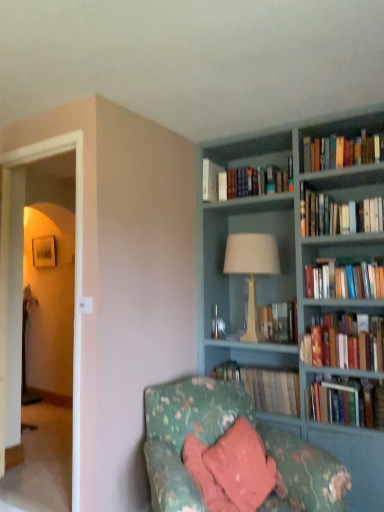
Locate an element on the screen. hardcover books at upper right, acting as the fifth book starting from the top is located at coordinates (344, 281).

I want to click on hardcover books at center, the fourth book in the bottom-to-top sequence, so click(279, 322).

The image size is (384, 512). Describe the element at coordinates (290, 281) in the screenshot. I see `teal painted wood bookcase at upper right` at that location.

Locate an element on the screen. The width and height of the screenshot is (384, 512). white fabric lampshade at center is located at coordinates (252, 269).

What is the approximate height of hardcover book at right, acting as the 3th book starting from the bottom?

It is 33.85 centimeters.

What do you see at coordinates (344, 342) in the screenshot? I see `hardcover book at right, acting as the 3th book starting from the bottom` at bounding box center [344, 342].

This screenshot has height=512, width=384. I want to click on hardcover books at upper right, acting as the fifth book starting from the top, so click(x=344, y=281).

In the scene shown: Is hardcover book at center, which ranks as the 2th book in bottom-to-top order, placed right next to hardcover book at right, acting as the 3th book starting from the bottom?

No, hardcover book at center, which ranks as the 2th book in bottom-to-top order, is not making contact with hardcover book at right, acting as the 3th book starting from the bottom.

Considering the positions of objects hardcover book at center, which ranks as the 2th book in bottom-to-top order, and hardcover book at right, acting as the 3th book starting from the bottom, in the image provided, who is behind, hardcover book at center, which ranks as the 2th book in bottom-to-top order, or hardcover book at right, acting as the 3th book starting from the bottom,?

hardcover book at center, which ranks as the 2th book in bottom-to-top order, is behind.

From the image's perspective, is hardcover book at center, which ranks as the 2th book in bottom-to-top order, above hardcover book at right, the 7th book from the top?

No.

At what (x,y) coordinates should I click in order to perform the action: click on the 1st book behind the hardcover book at right, the 7th book from the top. Please return your answer as a coordinate pair (x, y). Looking at the image, I should click on (347, 402).

Is hardcover books at upper center, the 7th book from the bottom, aimed at white fabric lampshade at center?

No, hardcover books at upper center, the 7th book from the bottom, is not oriented towards white fabric lampshade at center.

Based on the photo, is hardcover books at upper center, the 7th book from the bottom, beside white fabric lampshade at center?

hardcover books at upper center, the 7th book from the bottom, and white fabric lampshade at center are clearly separated.

Which object is wider, hardcover books at upper center, the 7th book from the bottom, or white fabric lampshade at center?

With larger width is white fabric lampshade at center.

Between hardcover books at upper center, positioned as the third book in top-to-bottom order, and white fabric lampshade at center, which one has more height?

white fabric lampshade at center.

Is teal painted wood bookcase at upper right not close to floral fabric couch at lower right?

teal painted wood bookcase at upper right is near floral fabric couch at lower right, not far away.

From the picture: From a real-world perspective, is teal painted wood bookcase at upper right above or below floral fabric couch at lower right?

In terms of real-world spatial position, teal painted wood bookcase at upper right is above floral fabric couch at lower right.

Visually, is teal painted wood bookcase at upper right positioned to the left or to the right of floral fabric couch at lower right?

From the image, it's evident that teal painted wood bookcase at upper right is to the right of floral fabric couch at lower right.

Does point (231, 244) appear closer or farther from the camera than point (264, 362)?

Point (231, 244) is closer to the camera than point (264, 362).

Between white fabric lampshade at center and teal painted wood bookcase at upper right, which one has larger size?

teal painted wood bookcase at upper right is bigger.

Is white fabric lampshade at center positioned in front of teal painted wood bookcase at upper right?

No, white fabric lampshade at center is further to the viewer.

Is white fabric lampshade at center not inside teal painted wood bookcase at upper right?

Actually, white fabric lampshade at center is within teal painted wood bookcase at upper right.

From the image's perspective, which book is the 3rd one above the hardcover book at right, acting as the 3th book starting from the bottom? Please provide its 2D coordinates.

[(338, 214)]

From a real-world perspective, between hardcover book at right, acting as the 3th book starting from the bottom, and hardcover books at upper right, arranged as the 4th book when viewed from the top, who is vertically higher?

hardcover books at upper right, arranged as the 4th book when viewed from the top, is physically above.

Could you measure the distance between hardcover book at right, the 7th book from the top, and hardcover books at upper right, the 6th book when ordered from bottom to top?

A distance of 62.58 centimeters exists between hardcover book at right, the 7th book from the top, and hardcover books at upper right, the 6th book when ordered from bottom to top.

Which of these two, hardcover book at right, the 7th book from the top, or hardcover books at upper right, arranged as the 4th book when viewed from the top, is thinner?

hardcover book at right, the 7th book from the top.

Is hardcover books at upper right, arranged as the 4th book when viewed from the top, in front of white matte book at upper center, acting as the 8th book starting from the bottom?

Yes, hardcover books at upper right, arranged as the 4th book when viewed from the top, is in front of white matte book at upper center, acting as the 8th book starting from the bottom.

Is white matte book at upper center, acting as the 8th book starting from the bottom, surrounded by hardcover books at upper right, the 6th book when ordered from bottom to top?

No, white matte book at upper center, acting as the 8th book starting from the bottom, is not surrounded by hardcover books at upper right, the 6th book when ordered from bottom to top.

Can you tell me how much hardcover books at upper right, arranged as the 4th book when viewed from the top, and white matte book at upper center, acting as the 8th book starting from the bottom, differ in facing direction?

They differ by 0.68 degrees in their facing directions.

Based on the photo, how far apart are hardcover books at upper right, the 6th book when ordered from bottom to top, and white matte book at upper center, arranged as the second book when viewed from the top?

hardcover books at upper right, the 6th book when ordered from bottom to top, and white matte book at upper center, arranged as the second book when viewed from the top, are 32.12 inches apart from each other.

Is transparent glass door at left with wooden book at center, the 1th book in the bottom-to-top sequence?

No, transparent glass door at left is not with wooden book at center, the 1th book in the bottom-to-top sequence.

From the image's perspective, count 4th books downward from the transparent glass door at left and point to it. Please provide its 2D coordinates.

[(265, 386)]

Considering the relative sizes of transparent glass door at left and wooden book at center, the 1th book in the bottom-to-top sequence, in the image provided, is transparent glass door at left wider than wooden book at center, the 1th book in the bottom-to-top sequence,?

In fact, transparent glass door at left might be narrower than wooden book at center, the 1th book in the bottom-to-top sequence.

There is a hardcover book at center, which ranks as the 2th book in bottom-to-top order. Where is `the 1st book above it (from the image's perspective)`? the 1st book above it (from the image's perspective) is located at coordinates (344, 342).

Where is `table lamp that appears on the left of hardcover books at upper center, positioned as the third book in top-to-bottom order`? Image resolution: width=384 pixels, height=512 pixels. table lamp that appears on the left of hardcover books at upper center, positioned as the third book in top-to-bottom order is located at coordinates click(252, 269).

Looking at the image, which one is located further to white matte book at upper center, arranged as the second book when viewed from the top, hardcover books at upper right, which is the 1th book in top-to-bottom order, or white fabric lampshade at center?

The object further to white matte book at upper center, arranged as the second book when viewed from the top, is hardcover books at upper right, which is the 1th book in top-to-bottom order.

From the image, which object appears to be nearer to hardcover books at upper right, the 6th book when ordered from bottom to top, hardcover books at upper right, marked as the fifth book in a bottom-to-top arrangement, or hardcover books at center, the fourth book in the bottom-to-top sequence?

Among the two, hardcover books at upper right, marked as the fifth book in a bottom-to-top arrangement, is located nearer to hardcover books at upper right, the 6th book when ordered from bottom to top.

When comparing their distances from hardcover book at center, which ranks as the 2th book in bottom-to-top order, does white fabric lampshade at center or wooden book at center, the 1th book in the bottom-to-top sequence, seem further?

white fabric lampshade at center is positioned further to the anchor hardcover book at center, which ranks as the 2th book in bottom-to-top order.

From the image, which object appears to be farther from wooden book at center, the ninth book when ordered from top to bottom, white matte book at upper center, arranged as the second book when viewed from the top, or floral fabric couch at lower right?

white matte book at upper center, arranged as the second book when viewed from the top, is positioned further to the anchor wooden book at center, the ninth book when ordered from top to bottom.

From the picture: Which object lies nearer to the anchor point floral fabric couch at lower right, transparent glass door at left or hardcover books at center, the 6th book positioned from the top?

The object closer to floral fabric couch at lower right is hardcover books at center, the 6th book positioned from the top.

Based on the photo, which object lies nearer to the anchor point transparent glass door at left, floral fabric couch at lower right or teal painted wood bookcase at upper right?

floral fabric couch at lower right is closer to transparent glass door at left.

Estimate the real-world distances between objects in this image. Which object is closer to hardcover book at center, the 8th book viewed from the top, floral fabric couch at lower right or hardcover books at upper right, marked as the fifth book in a bottom-to-top arrangement?

floral fabric couch at lower right lies closer to hardcover book at center, the 8th book viewed from the top, than the other object.

When comparing their distances from hardcover book at center, which ranks as the 2th book in bottom-to-top order, does white fabric lampshade at center or hardcover books at center, the 6th book positioned from the top, seem closer?

Based on the image, hardcover books at center, the 6th book positioned from the top, appears to be nearer to hardcover book at center, which ranks as the 2th book in bottom-to-top order.

Where is `bookcase between white matte book at upper center, arranged as the second book when viewed from the top, and hardcover book at right, the 7th book from the top, in the vertical direction`? The width and height of the screenshot is (384, 512). bookcase between white matte book at upper center, arranged as the second book when viewed from the top, and hardcover book at right, the 7th book from the top, in the vertical direction is located at coordinates (290, 281).

At what (x,y) coordinates should I click in order to perform the action: click on table lamp between hardcover books at upper center, the 7th book from the bottom, and floral fabric couch at lower right in the up-down direction. Please return your answer as a coordinate pair (x, y). Image resolution: width=384 pixels, height=512 pixels. Looking at the image, I should click on (252, 269).

The width and height of the screenshot is (384, 512). I want to click on bookcase between hardcover books at upper right, the 6th book when ordered from bottom to top, and hardcover book at center, which ranks as the 2th book in bottom-to-top order, from top to bottom, so click(290, 281).

Where is `bookcase between white matte book at upper center, acting as the 8th book starting from the bottom, and wooden book at center, the 1th book in the bottom-to-top sequence, vertically`? bookcase between white matte book at upper center, acting as the 8th book starting from the bottom, and wooden book at center, the 1th book in the bottom-to-top sequence, vertically is located at coordinates (290, 281).